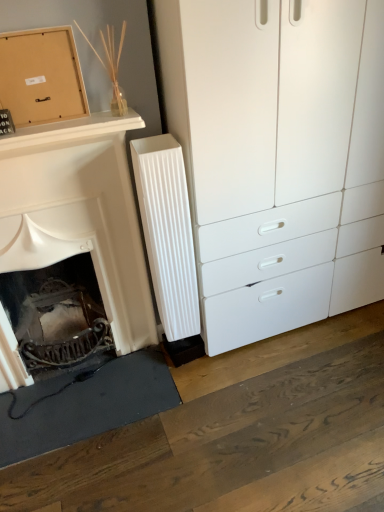
At what (x,y) coordinates should I click in order to perform the action: click on free point to the right of white ribbed radiator at center. Please return your answer as a coordinate pair (x, y). This screenshot has height=512, width=384. Looking at the image, I should click on (217, 362).